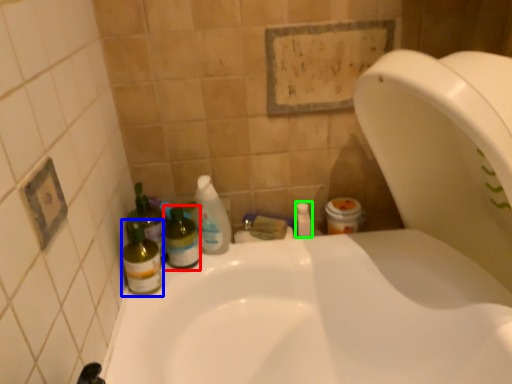
Question: Which is nearer to the bottle (highlighted by a red box)? bottle (highlighted by a blue box) or mouthwash (highlighted by a green box).

Choices:
 (A) bottle
 (B) mouthwash

Answer: (A)